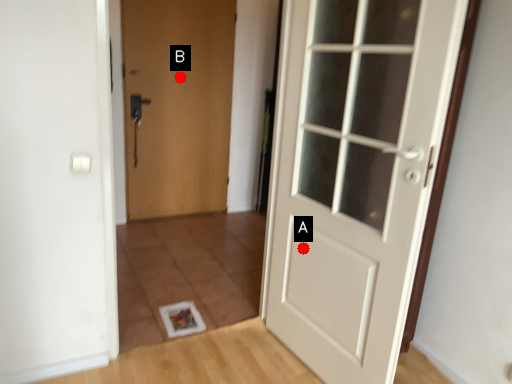
Question: Two points are circled on the image, labeled by A and B beside each circle. Which of the following is the farthest from the observer?

Choices:
 (A) A is further
 (B) B is further

Answer: (B)